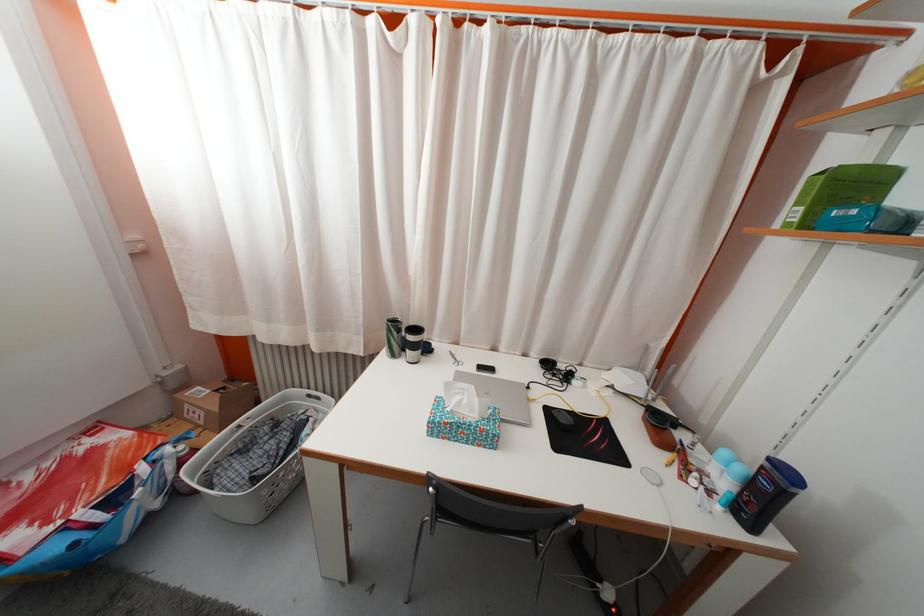
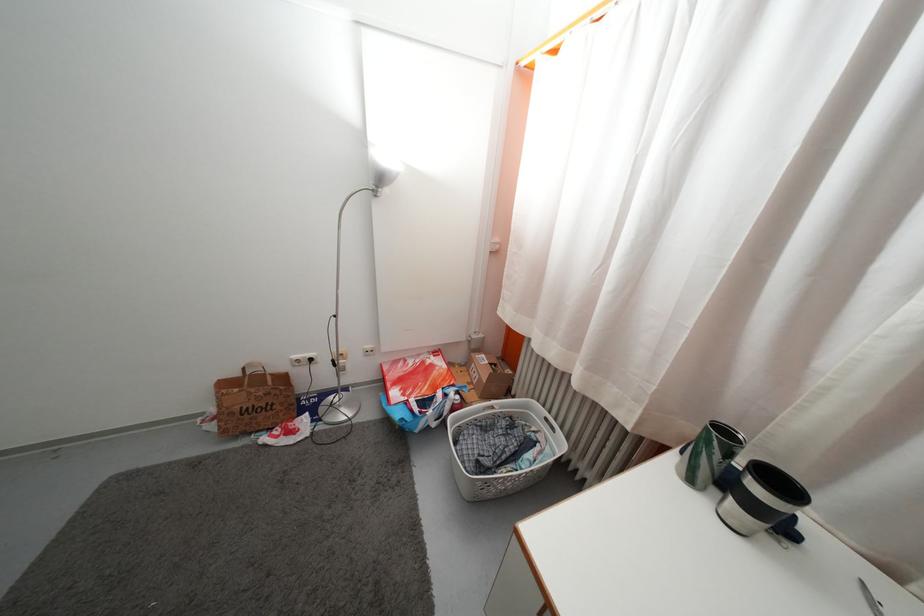
The point at (398, 363) is marked in the first image. Where is the corresponding point in the second image?

(697, 488)